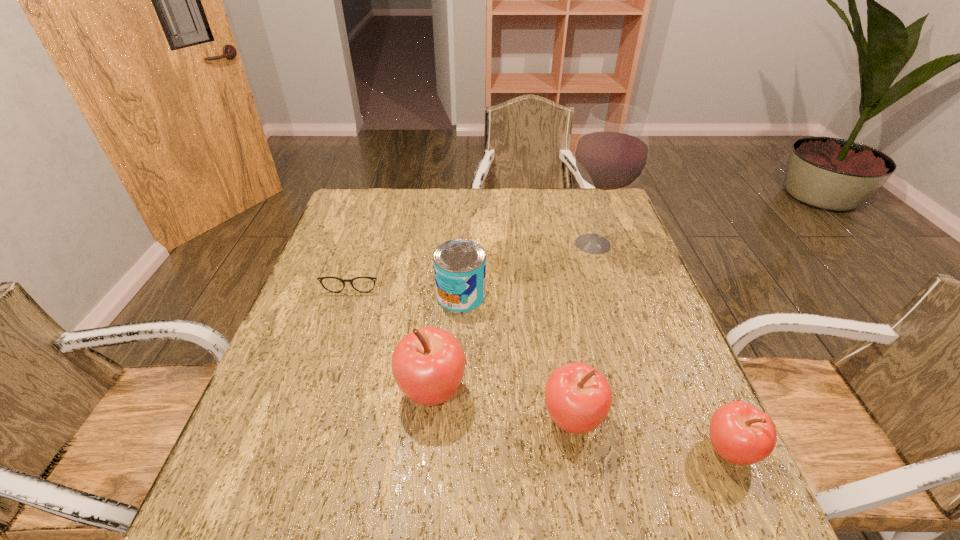
Locate an element on the screen. The image size is (960, 540). free space at the near edge of the desktop is located at coordinates (371, 458).

This screenshot has width=960, height=540. I want to click on vacant area at the left edge, so click(x=343, y=321).

In order to click on free space at the right edge of the desktop in this screenshot , I will do `click(626, 267)`.

You are a GUI agent. You are given a task and a screenshot of the screen. Output one action in this format:
    pyautogui.click(x=<x>, y=<y>)
    Task: Click on the vacant area at the far left corner
    This screenshot has width=960, height=540.
    Given the screenshot: What is the action you would take?
    pyautogui.click(x=336, y=221)

This screenshot has height=540, width=960. In order to click on free space at the far right corner of the desktop in this screenshot , I will do `click(585, 212)`.

Locate an element on the screen. vacant space that's between the can and the shortest object is located at coordinates (409, 284).

The height and width of the screenshot is (540, 960). Find the location of `free spot between the can and the tallest object`. free spot between the can and the tallest object is located at coordinates (527, 269).

Find the location of a particular element. vacant area that lies between the alcohol and the can is located at coordinates (527, 269).

This screenshot has height=540, width=960. Identify the location of free space between the rightmost apple and the shortest object. (542, 361).

Where is `free space between the second apple from left to right and the can`? free space between the second apple from left to right and the can is located at coordinates (516, 357).